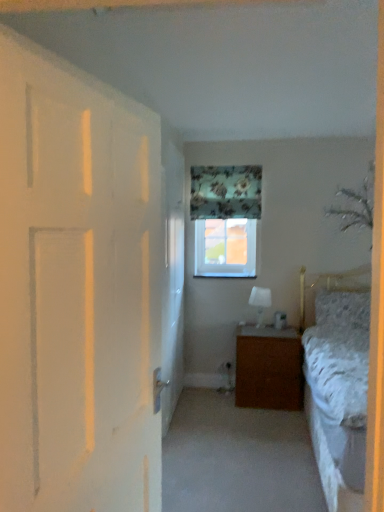
This screenshot has width=384, height=512. Find the location of `empty space that is to the right of white glossy screen door at center`. empty space that is to the right of white glossy screen door at center is located at coordinates (215, 408).